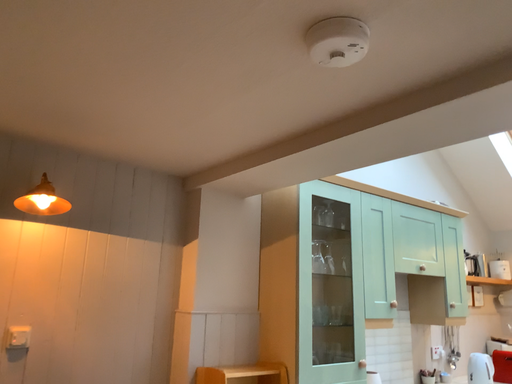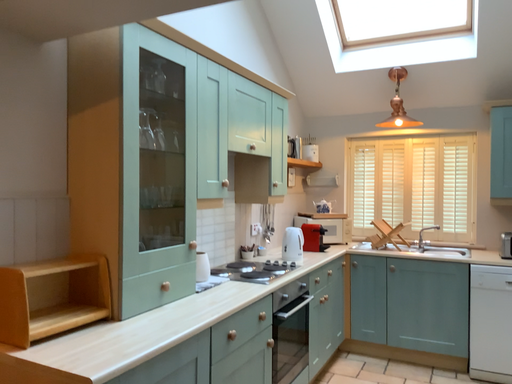
Question: Which way did the camera rotate in the video?

Choices:
 (A) rotated right
 (B) rotated left

Answer: (A)